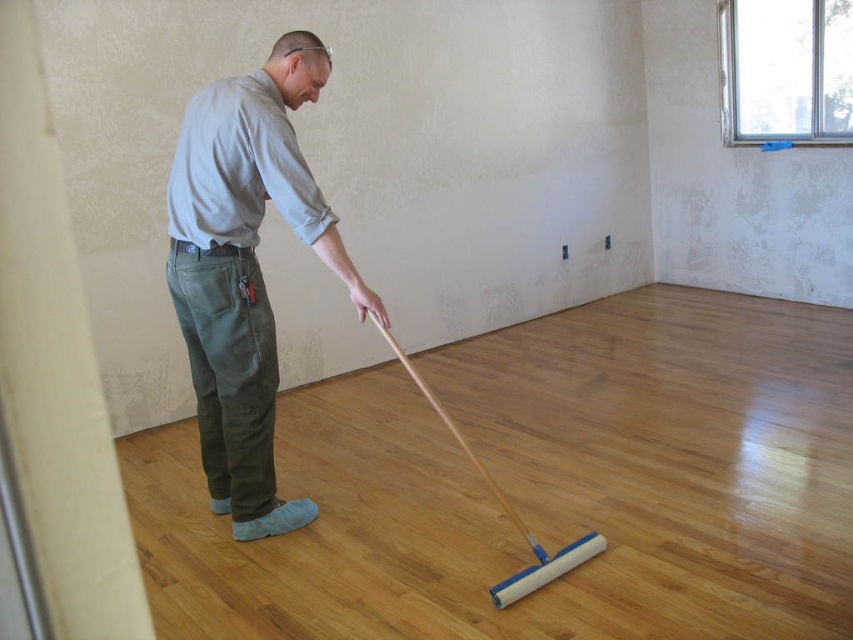
Question: Which point is farther to the camera?

Choices:
 (A) light gray cotton shirt at center
 (B) white foam swab at center

Answer: (A)

Question: Is light gray cotton shirt at center above white foam swab at center?

Choices:
 (A) yes
 (B) no

Answer: (A)

Question: Is light gray cotton shirt at center below white foam swab at center?

Choices:
 (A) no
 (B) yes

Answer: (A)

Question: Which object appears closest to the camera in this image?

Choices:
 (A) white foam swab at center
 (B) light gray cotton shirt at center

Answer: (A)

Question: Can you confirm if light gray cotton shirt at center is thinner than white foam swab at center?

Choices:
 (A) yes
 (B) no

Answer: (A)